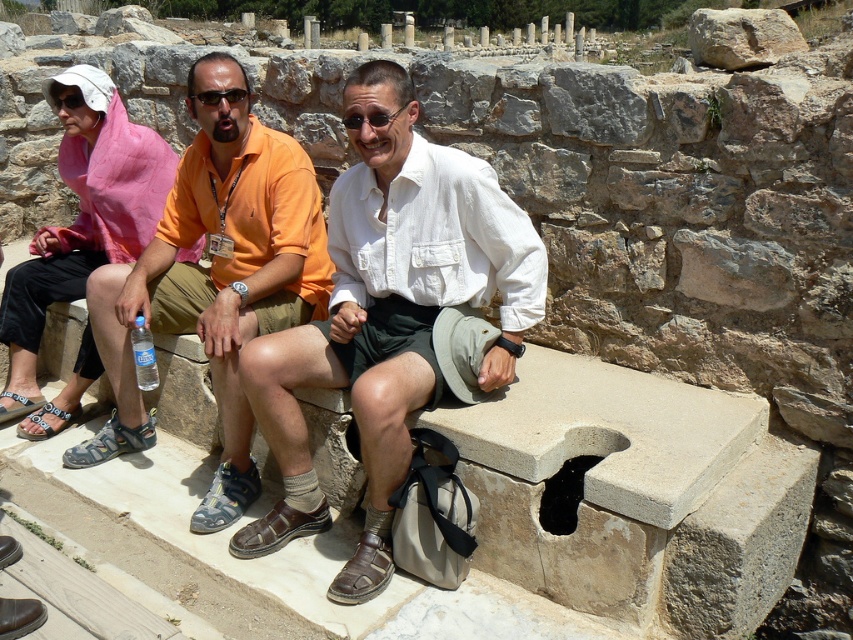
Can you confirm if white cotton shirt at center is positioned to the right of gray fabric sandal at lower left?

Yes, white cotton shirt at center is to the right of gray fabric sandal at lower left.

Between white cotton shirt at center and gray fabric sandal at lower left, which one has more height?

white cotton shirt at center is taller.

Identify the location of white cotton shirt at center. Image resolution: width=853 pixels, height=640 pixels. (387, 314).

Locate an element on the screen. This screenshot has width=853, height=640. white cotton shirt at center is located at coordinates (387, 314).

Does white cotton shirt at center lie behind pink fabric headscarf at upper left?

That is False.

Does white cotton shirt at center have a smaller size compared to pink fabric headscarf at upper left?

No, white cotton shirt at center is not smaller than pink fabric headscarf at upper left.

Who is more distant from viewer, (392, 294) or (142, 188)?

The point (142, 188) is more distant.

In order to click on white cotton shirt at center in this screenshot , I will do `click(387, 314)`.

Based on the photo, is pink fabric headscarf at upper left closer to the viewer compared to gray fabric sandal at lower left?

No, it is not.

Who is positioned more to the right, pink fabric headscarf at upper left or gray fabric sandal at lower left?

From the viewer's perspective, pink fabric headscarf at upper left appears more on the right side.

Which is in front, point (39, 314) or point (55, 406)?

Point (55, 406) is more forward.

Where is `pink fabric headscarf at upper left`? The height and width of the screenshot is (640, 853). pink fabric headscarf at upper left is located at coordinates (82, 218).